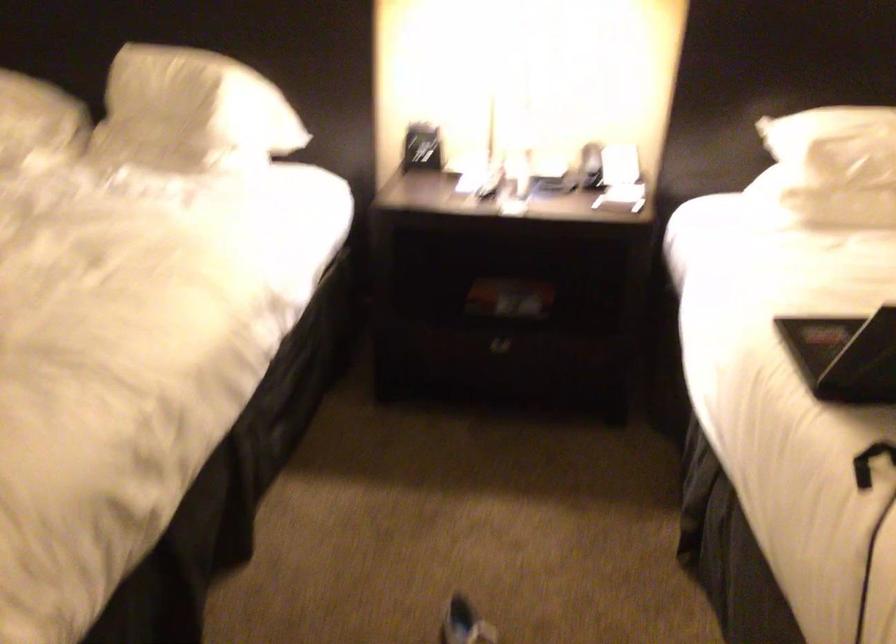
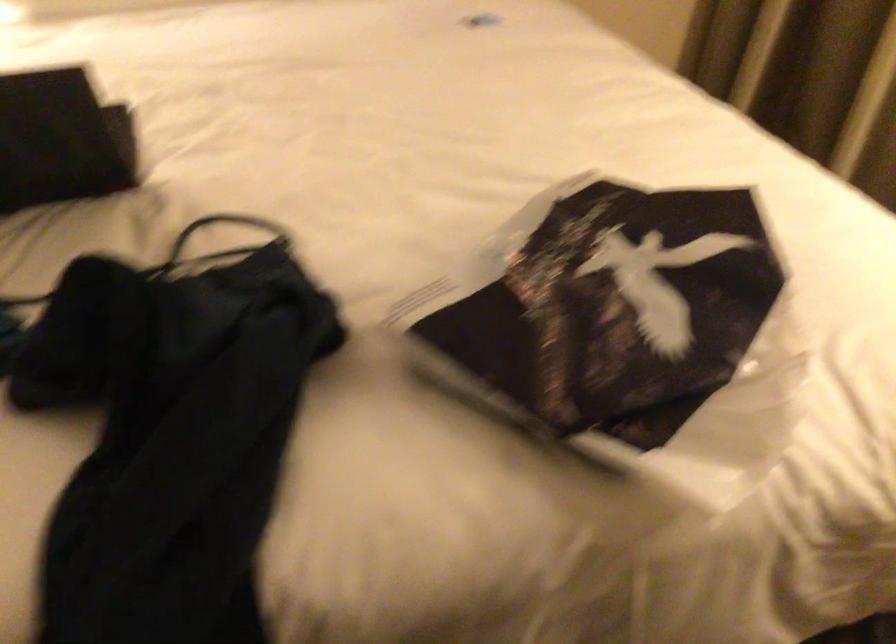
Question: The camera is either moving clockwise (left) or counter-clockwise (right) around the object. The first image is from the beginning of the video and the second image is from the end. Is the camera moving left or right when shooting the video?

Choices:
 (A) Left
 (B) Right

Answer: (A)